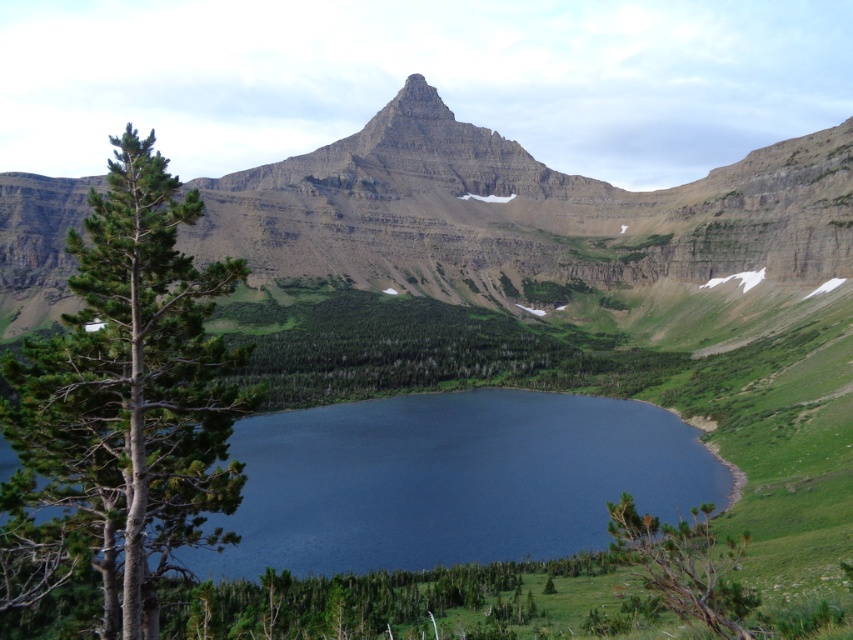
At what (x,y) coordinates should I click in order to perform the action: click on rugged rock mountain at center. Please return your answer as a coordinate pair (x, y). The width and height of the screenshot is (853, 640). Looking at the image, I should click on (519, 212).

This screenshot has width=853, height=640. Identify the location of rugged rock mountain at center. (519, 212).

Find the location of a particular element. This screenshot has height=640, width=853. rugged rock mountain at center is located at coordinates (519, 212).

Does deep blue water at center have a lesser height compared to green needle-like tree at left?

Yes, deep blue water at center is shorter than green needle-like tree at left.

Find the location of a particular element. deep blue water at center is located at coordinates (451, 481).

What do you see at coordinates (451, 481) in the screenshot? The height and width of the screenshot is (640, 853). I see `deep blue water at center` at bounding box center [451, 481].

Locate an element on the screen. The image size is (853, 640). deep blue water at center is located at coordinates (451, 481).

Does rugged rock mountain at center have a lesser height compared to green matte tree at lower right?

No.

Who is shorter, rugged rock mountain at center or green matte tree at lower right?

Standing shorter between the two is green matte tree at lower right.

Is point (485, 184) in front of point (689, 602)?

No, (485, 184) is behind (689, 602).

What are the coordinates of `rugged rock mountain at center` in the screenshot? It's located at (519, 212).